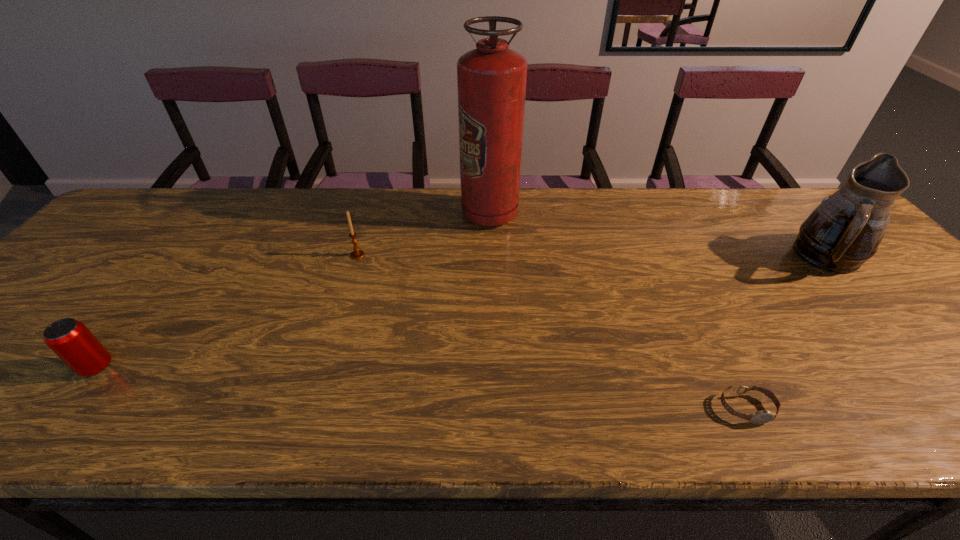
In the image, there is a desktop. Where is `vacant space at the left edge`? This screenshot has height=540, width=960. vacant space at the left edge is located at coordinates (58, 300).

Where is `free region at the far left corner of the desktop`? This screenshot has height=540, width=960. free region at the far left corner of the desktop is located at coordinates (155, 189).

In the image, there is a desktop. Where is `vacant space at the far right corner`? vacant space at the far right corner is located at coordinates (780, 205).

At what (x,y) coordinates should I click in order to perform the action: click on empty space that is in between the fourth shortest object and the second object from left to right. Please return your answer as a coordinate pair (x, y). Image resolution: width=960 pixels, height=540 pixels. Looking at the image, I should click on coord(593,256).

At what (x,y) coordinates should I click in order to perform the action: click on vacant space that is in between the pitcher and the candle_holder. Please return your answer as a coordinate pair (x, y). Looking at the image, I should click on (593, 256).

The width and height of the screenshot is (960, 540). Find the location of `vacant area that lies between the tallest object and the nearest object`. vacant area that lies between the tallest object and the nearest object is located at coordinates (618, 311).

You are a GUI agent. You are given a task and a screenshot of the screen. Output one action in this format:
    pyautogui.click(x=<x>, y=<y>)
    Task: Click on the free point between the second object from right to left and the candle_holder
    
    Given the screenshot: What is the action you would take?
    pyautogui.click(x=552, y=332)

Find the location of a particular element. This screenshot has width=960, height=540. vacant area that lies between the fire extinguisher and the second object from right to left is located at coordinates (618, 311).

You are a GUI agent. You are given a task and a screenshot of the screen. Output one action in this format:
    pyautogui.click(x=<x>, y=<y>)
    Task: Click on the vacant space that's between the leftmost object and the fourth shortest object
    
    Given the screenshot: What is the action you would take?
    pyautogui.click(x=463, y=312)

The height and width of the screenshot is (540, 960). Find the location of `free space that is in between the second tallest object and the nearest object`. free space that is in between the second tallest object and the nearest object is located at coordinates (787, 333).